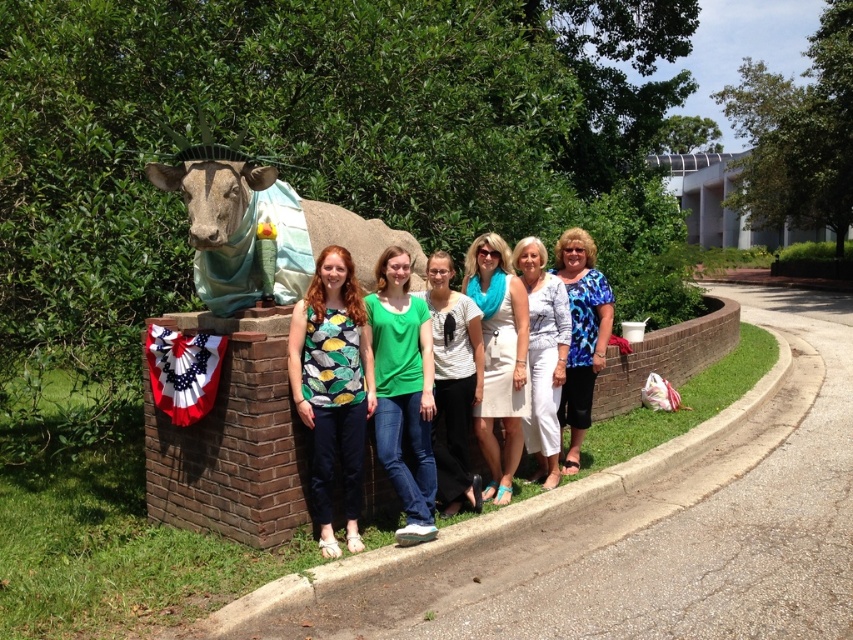
Question: Among these points, which one is nearest to the camera?

Choices:
 (A) (419, 467)
 (B) (589, 416)
 (C) (345, 524)
 (D) (436, 451)

Answer: (C)

Question: Which point is closer to the camera?

Choices:
 (A) blue printed blouse at center
 (B) white cotton blouse at center
 (C) printed fabric blouse at center

Answer: (C)

Question: In this image, where is green cotton shirt at center located relative to white cotton blouse at center?

Choices:
 (A) right
 (B) left

Answer: (B)

Question: Is green cotton shirt at center further to the viewer compared to blue printed blouse at center?

Choices:
 (A) no
 (B) yes

Answer: (A)

Question: Which point is closer to the camera?

Choices:
 (A) green cotton shirt at center
 (B) white textured blouse at center
 (C) blue printed blouse at center

Answer: (A)

Question: Is white textured blouse at center thinner than blue printed blouse at center?

Choices:
 (A) no
 (B) yes

Answer: (A)